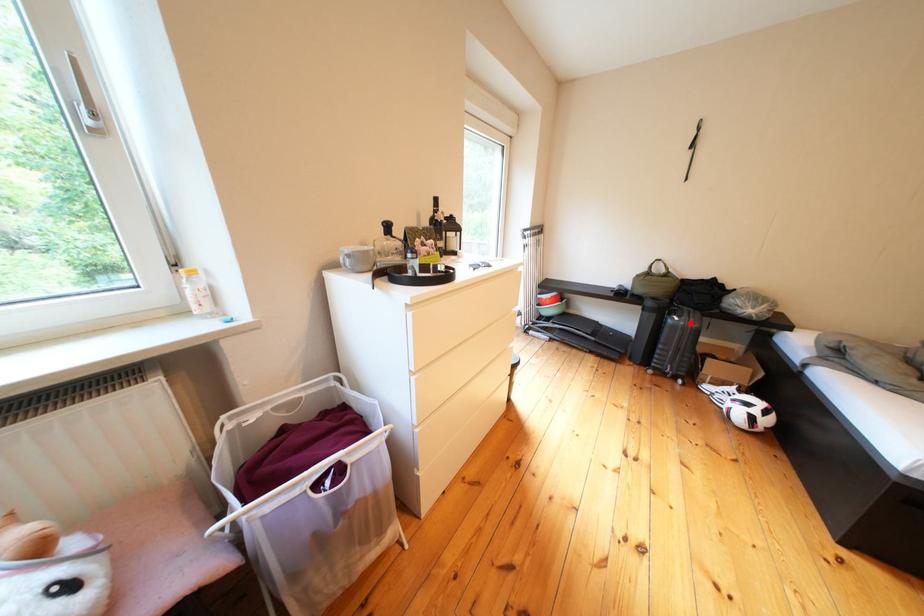
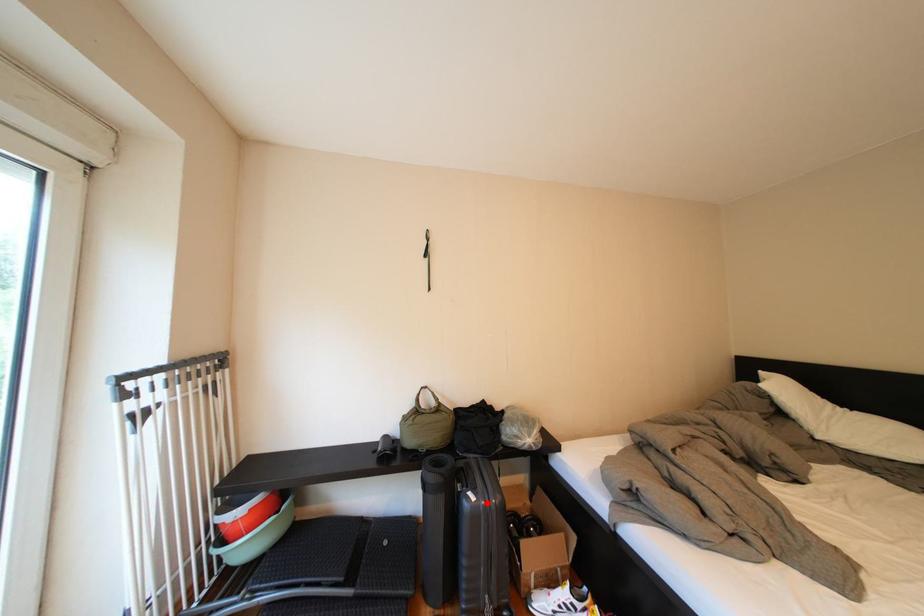
I am providing you with two images of the same scene from different viewpoints. A red point is marked on the first image and another point is marked on the second image. Do the highlighted points in image1 and image2 indicate the same real-world spot?

Yes